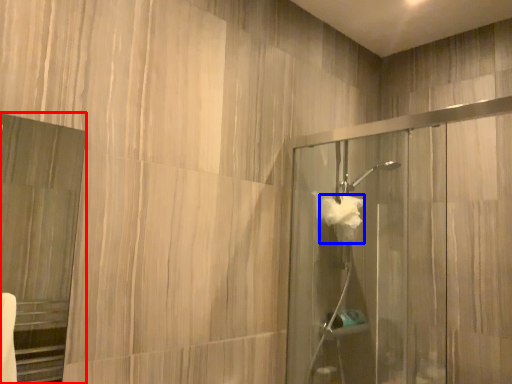
Question: Which of the following is the farthest to the observer, screen door (highlighted by a red box) or hand towel (highlighted by a blue box)?

Choices:
 (A) screen door
 (B) hand towel

Answer: (B)